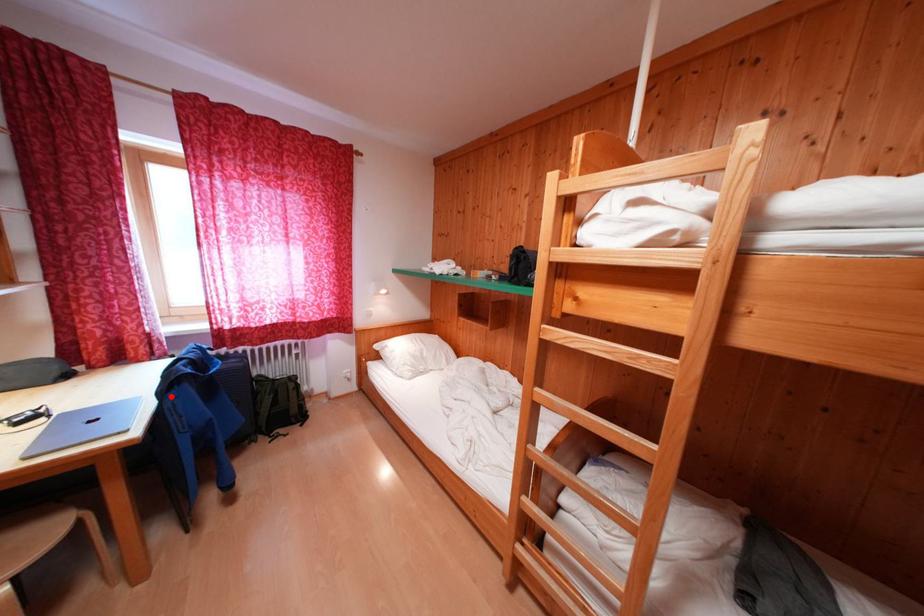
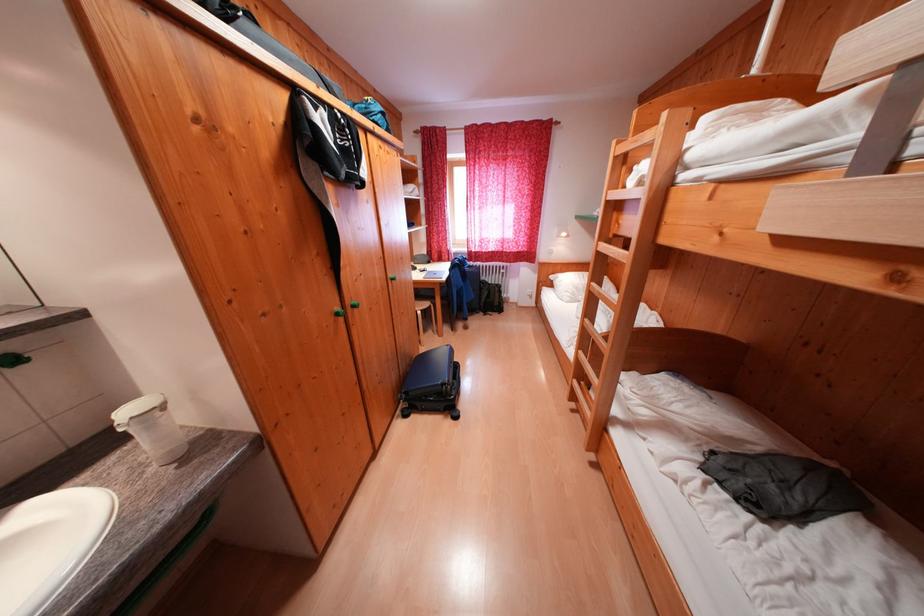
Question: I am providing you with two images of the same scene from different viewpoints. Image1 has a red point marked. In image2, the corresponding 3D location appears at what relative position? Reply with the corresponding letter.

Choices:
 (A) Closer
 (B) Farther

Answer: (A)